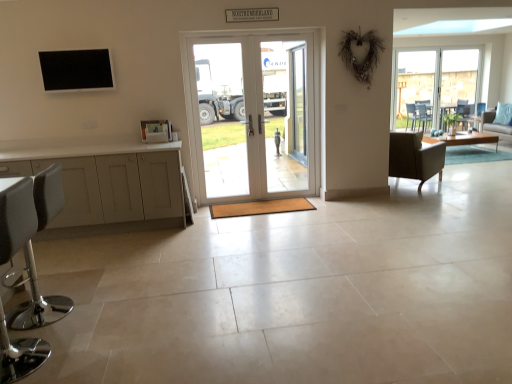
Question: Would you say white glossy door at center is to the left or to the right of clear glass door at center, placed as the 1th screen door when sorted from left to right, in the picture?

Choices:
 (A) left
 (B) right

Answer: (B)

Question: Considering the positions of white glossy door at center and clear glass door at center, placed as the 1th screen door when sorted from left to right, in the image, is white glossy door at center wider or thinner than clear glass door at center, placed as the 1th screen door when sorted from left to right,?

Choices:
 (A) wide
 (B) thin

Answer: (A)

Question: Estimate the real-world distances between objects in this image. Which object is closer to the clear glass door at center, which appears as the 2th screen door when viewed from the left?

Choices:
 (A) matte gray cabinet at left
 (B) white glossy door at center
 (C) light brown wooden coffee table at right
 (D) light blue fabric couch at right
 (E) dark brown leather chair at right, which appears as the second chair when viewed from the left

Answer: (B)

Question: Which object is positioned farthest from the black matte tv at upper left?

Choices:
 (A) white leather stool at lower left, which is counted as the second chair, starting from the back
 (B) light blue fabric couch at right
 (C) clear glass door at center, the first screen door positioned from the right
 (D) clear glass door at center, arranged as the second screen door when viewed from the right
 (E) white glossy door at center

Answer: (B)